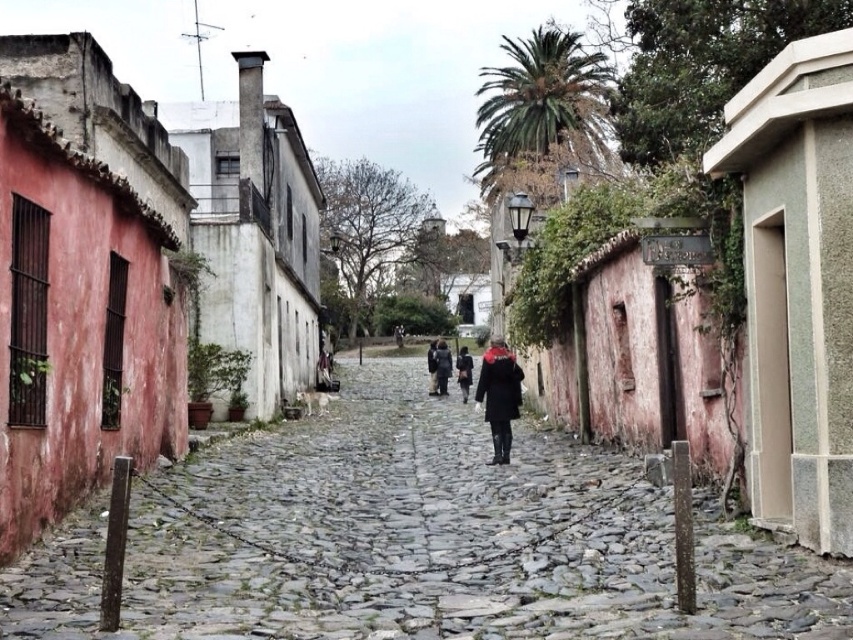
Question: Is dark gray coat at center to the left of dark brown leather jacket at center from the viewer's perspective?

Choices:
 (A) yes
 (B) no

Answer: (B)

Question: Considering the real-world distances, which object is farthest from the dark brown leather jacket at center?

Choices:
 (A) dark gray coat at center
 (B) dark red wool coat at center
 (C) cobblestone street at center

Answer: (C)

Question: Is cobblestone street at center thinner than dark gray coat at center?

Choices:
 (A) yes
 (B) no

Answer: (B)

Question: Which point is farther from the camera taking this photo?

Choices:
 (A) (465, 352)
 (B) (505, 355)
 (C) (448, 356)

Answer: (C)

Question: Can you confirm if dark red wool coat at center is positioned above dark brown leather jacket at center?

Choices:
 (A) no
 (B) yes

Answer: (A)

Question: Which object is closer to the camera taking this photo?

Choices:
 (A) dark gray coat at center
 (B) dark red wool coat at center
 (C) cobblestone street at center

Answer: (C)